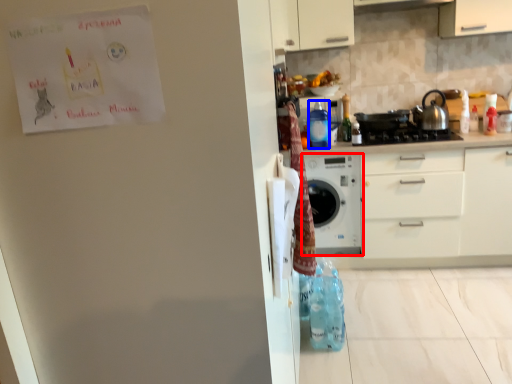
Question: Which of the following is the farthest to the observer, home appliance (highlighted by a red box) or bottle (highlighted by a blue box)?

Choices:
 (A) home appliance
 (B) bottle

Answer: (A)